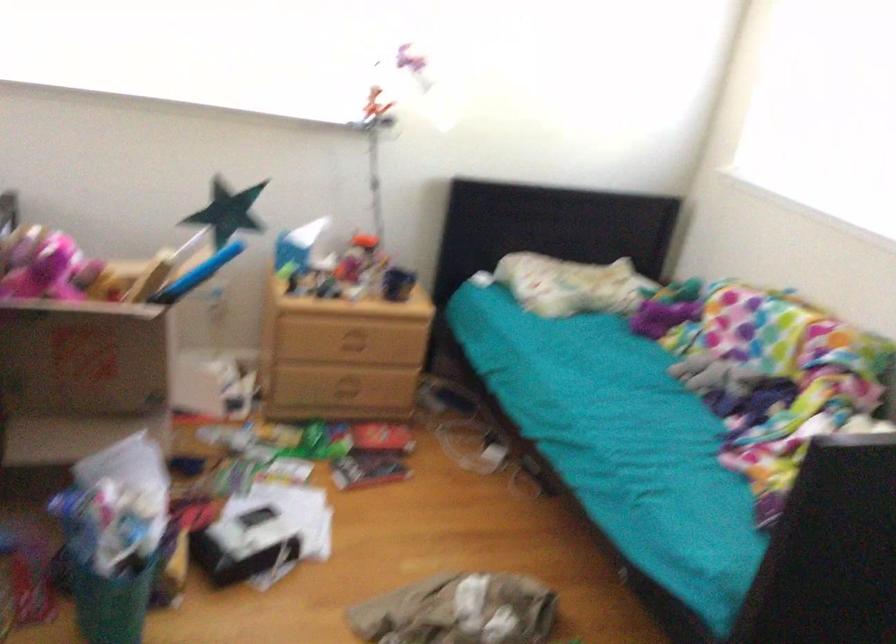
The width and height of the screenshot is (896, 644). What do you see at coordinates (572, 285) in the screenshot?
I see `a patterned pillow` at bounding box center [572, 285].